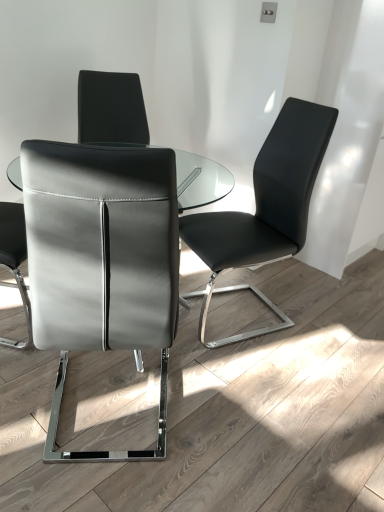
Question: Do you think black leather chair at center, the second chair positioned from the left, is within matte black chair at left, the 1th chair from the left, or outside of it?

Choices:
 (A) inside
 (B) outside

Answer: (B)

Question: Is black leather chair at center, the second chair positioned from the left, wider or thinner than matte black chair at left, positioned as the 2th chair in right-to-left order?

Choices:
 (A) wide
 (B) thin

Answer: (B)

Question: In terms of size, does black leather chair at center, the second chair positioned from the left, appear bigger or smaller than matte black chair at left, the 1th chair from the left?

Choices:
 (A) small
 (B) big

Answer: (B)

Question: Is matte black chair at left, the 1th chair from the left, taller or shorter than black leather chair at center, placed as the first chair when sorted from right to left?

Choices:
 (A) short
 (B) tall

Answer: (A)

Question: Is matte black chair at left, the 1th chair from the left, wider or thinner than black leather chair at center, placed as the first chair when sorted from right to left?

Choices:
 (A) wide
 (B) thin

Answer: (A)

Question: Is point (104, 229) positioned closer to the camera than point (263, 236)?

Choices:
 (A) farther
 (B) closer

Answer: (B)

Question: From a real-world perspective, is matte black chair at left, the 1th chair from the left, positioned above or below black leather chair at center, placed as the first chair when sorted from right to left?

Choices:
 (A) below
 (B) above

Answer: (B)